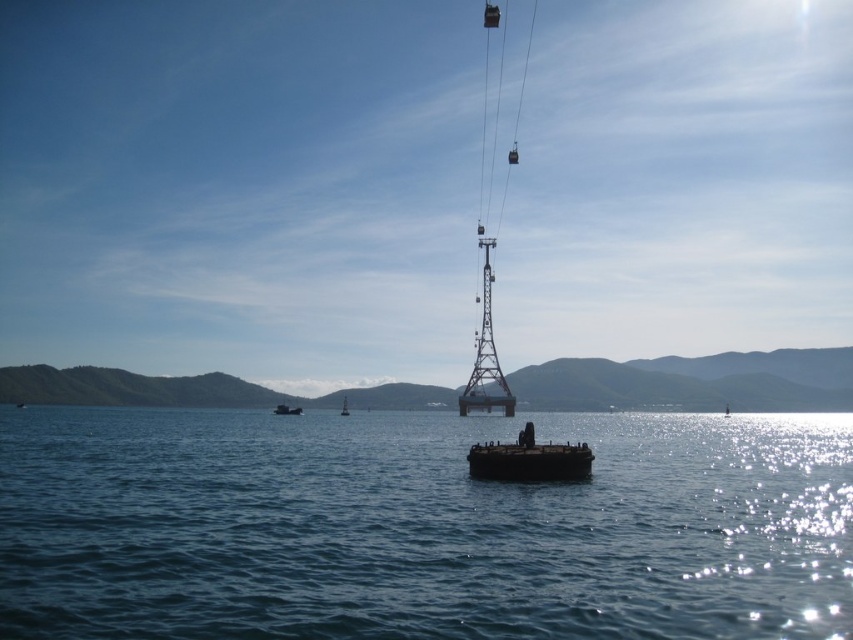
You are a photographer trying to capture the metallic gray buoy at center and the blue water at center in the same frame. Based on their positions, which object is located to the left of the other?

The metallic gray buoy at center is positioned on the left side of blue water at center.

You are standing at the cable car station structure and want to board the nearest gondola. However, you need to cross the dark matte barge at center to reach the station. Can you safely walk from your current position to the station structure without stepping onto the barge?

The dark matte barge at center is 92.30 meters away from the viewer. Since the barge is in the center, it is likely positioned between you and the station structure. To reach the station, you would have to walk around or over the barge, but since the distance is significant, it might be safer to use the provided pathways or ask for assistance to ensure safe passage.

Consider the image. You are standing on the shore and see the blue water at center and the dark brown wooden boat at center. Which object is positioned to the right when viewed from your perspective?

The blue water at center is to the right of the dark brown wooden boat at center.